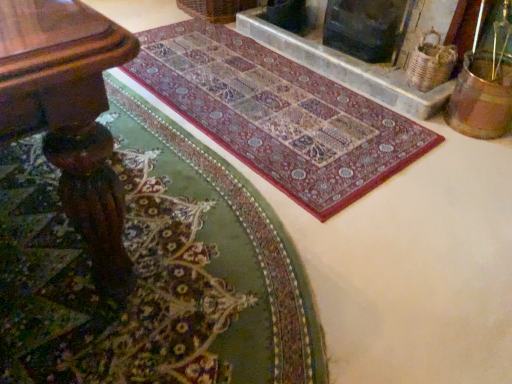
Question: Can you confirm if carpet with intricate patterns at center, the 2th mat in the front-to-back sequence, is positioned to the left of multicolored woven rug at center, marked as the first mat in a front-to-back arrangement?

Choices:
 (A) yes
 (B) no

Answer: (B)

Question: Considering the relative sizes of carpet with intricate patterns at center, the 1th mat in the back-to-front sequence, and multicolored woven rug at center, marked as the first mat in a front-to-back arrangement, in the image provided, is carpet with intricate patterns at center, the 1th mat in the back-to-front sequence, thinner than multicolored woven rug at center, marked as the first mat in a front-to-back arrangement,?

Choices:
 (A) no
 (B) yes

Answer: (B)

Question: From a real-world perspective, is carpet with intricate patterns at center, the 2th mat in the front-to-back sequence, located higher than multicolored woven rug at center, marked as the first mat in a front-to-back arrangement?

Choices:
 (A) yes
 (B) no

Answer: (B)

Question: Is carpet with intricate patterns at center, the 1th mat in the back-to-front sequence, far from multicolored woven rug at center, marked as the first mat in a front-to-back arrangement?

Choices:
 (A) yes
 (B) no

Answer: (B)

Question: Could multicolored woven rug at center, marked as the first mat in a front-to-back arrangement, be considered to be inside carpet with intricate patterns at center, the 2th mat in the front-to-back sequence?

Choices:
 (A) yes
 (B) no

Answer: (B)

Question: Is multicolored woven rug at center, marked as the first mat in a front-to-back arrangement, at the back of carpet with intricate patterns at center, the 2th mat in the front-to-back sequence?

Choices:
 (A) yes
 (B) no

Answer: (B)

Question: From the image's perspective, is wooden table at lower left above dark gray stone fireplace at upper center, acting as the first fireplace starting from the right?

Choices:
 (A) no
 (B) yes

Answer: (A)

Question: Is wooden table at lower left smaller than dark gray stone fireplace at upper center, acting as the first fireplace starting from the right?

Choices:
 (A) yes
 (B) no

Answer: (B)

Question: Is dark gray stone fireplace at upper center, which is the second fireplace in left-to-right order, at the back of wooden table at lower left?

Choices:
 (A) no
 (B) yes

Answer: (B)

Question: From a real-world perspective, is wooden table at lower left below dark gray stone fireplace at upper center, which is the second fireplace in left-to-right order?

Choices:
 (A) yes
 (B) no

Answer: (B)

Question: Can dark gray stone fireplace at upper center, which is the second fireplace in left-to-right order, be found inside wooden table at lower left?

Choices:
 (A) yes
 (B) no

Answer: (B)

Question: Considering the relative sizes of wooden table at lower left and dark gray stone fireplace at upper center, acting as the first fireplace starting from the right, in the image provided, is wooden table at lower left shorter than dark gray stone fireplace at upper center, acting as the first fireplace starting from the right,?

Choices:
 (A) yes
 (B) no

Answer: (B)

Question: Would you consider multicolored woven rug at center, marked as the first mat in a front-to-back arrangement, to be distant from marble fireplace at upper center, which ranks as the 1th fireplace in left-to-right order?

Choices:
 (A) yes
 (B) no

Answer: (A)